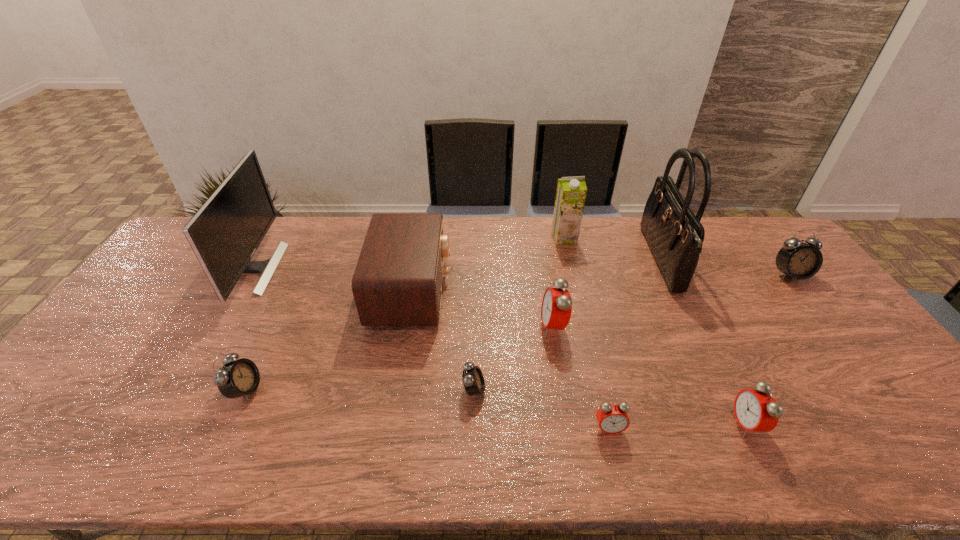
Image resolution: width=960 pixels, height=540 pixels. What are the coordinates of `vacant space situated 0.310m with an open clasp on the front of the tallest object` in the screenshot? It's located at click(558, 260).

Identify the location of blank space located with an open clasp on the front of the tallest object. (599, 260).

Identify the location of vacant space located 0.060m with an open clasp on the front of the tallest object. (633, 260).

Where is `vacant space located on the screen side of the leftmost object`? vacant space located on the screen side of the leftmost object is located at coordinates (355, 269).

You are a GUI agent. You are given a task and a screenshot of the screen. Output one action in this format:
    pyautogui.click(x=<x>, y=<y>)
    Task: Click on the vacant area situated 0.100m on the right of the green soya milk
    This screenshot has width=960, height=540.
    Given the screenshot: What is the action you would take?
    pyautogui.click(x=604, y=237)

Find the location of a particular element. The height and width of the screenshot is (540, 960). free location located 0.380m on the front panel of the seventh shortest object is located at coordinates (571, 291).

This screenshot has width=960, height=540. What are the coordinates of `free region located 0.130m on the front-facing side of the biggest red alarm clock` in the screenshot? It's located at (495, 327).

This screenshot has height=540, width=960. What are the coordinates of `vacant space located on the front-facing side of the biggest red alarm clock` in the screenshot? It's located at (495, 327).

At what (x,y) coordinates should I click in order to perform the action: click on vacant space located on the front-facing side of the biggest red alarm clock. Please return your answer as a coordinate pair (x, y). This screenshot has width=960, height=540. Looking at the image, I should click on (516, 327).

This screenshot has height=540, width=960. What are the coordinates of `vacant region located 0.400m on the face of the rightmost white alarm clock` in the screenshot? It's located at (884, 395).